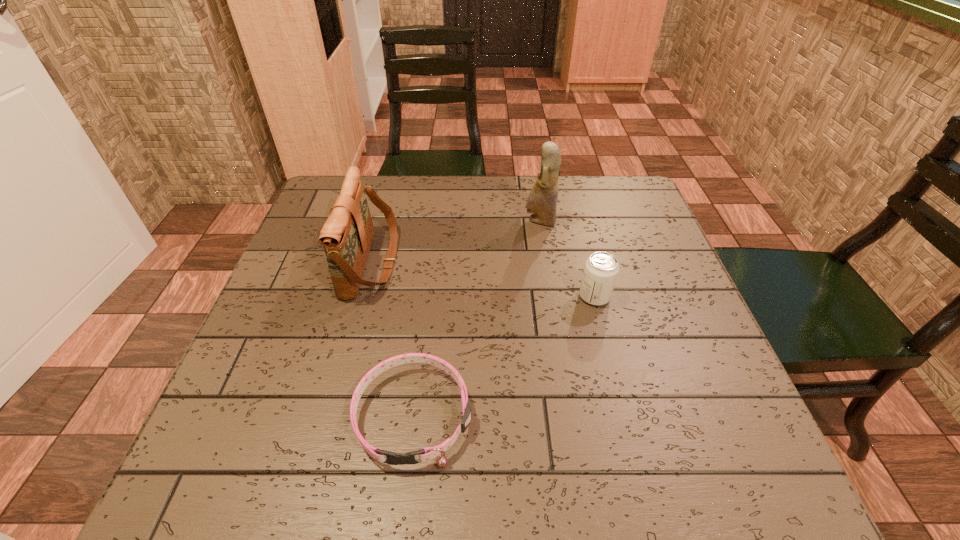
In the image, there is a desktop. Where is `vacant space at the near left corner`? The height and width of the screenshot is (540, 960). vacant space at the near left corner is located at coordinates (253, 490).

Where is `vacant space at the far right corner of the desktop`? The height and width of the screenshot is (540, 960). vacant space at the far right corner of the desktop is located at coordinates [x=626, y=197].

Locate an element on the screen. The height and width of the screenshot is (540, 960). vacant space that's between the second tallest object and the second shortest object is located at coordinates (483, 279).

Locate an element on the screen. The width and height of the screenshot is (960, 540). free space between the third tallest object and the second tallest object is located at coordinates (483, 279).

Identify the location of empty location between the nearest object and the shoulder bag. (x=393, y=339).

Image resolution: width=960 pixels, height=540 pixels. I want to click on free space between the soda can and the figurine, so click(x=567, y=259).

The image size is (960, 540). In order to click on unoccupied position between the third shortest object and the shortest object in this screenshot , I will do `click(393, 339)`.

This screenshot has width=960, height=540. Identify the location of free point between the rightmost object and the shoulder bag. (483, 279).

Find the location of `free area in between the third tallest object and the third shortest object`. free area in between the third tallest object and the third shortest object is located at coordinates (483, 279).

Where is `empty location between the soda can and the shoulder bag`? The width and height of the screenshot is (960, 540). empty location between the soda can and the shoulder bag is located at coordinates (483, 279).